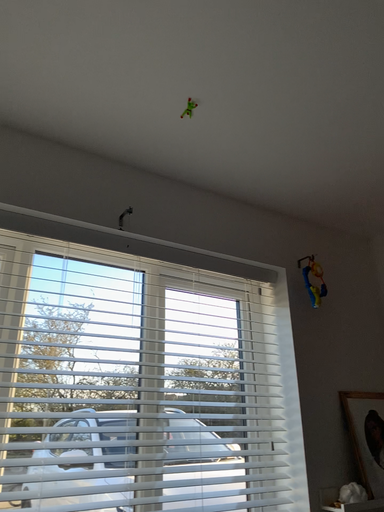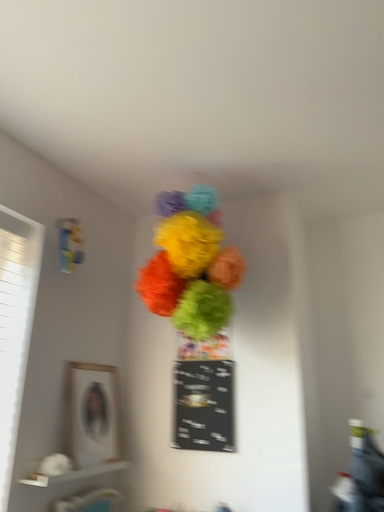
Question: How did the camera likely rotate when shooting the video?

Choices:
 (A) rotated right
 (B) rotated left

Answer: (A)